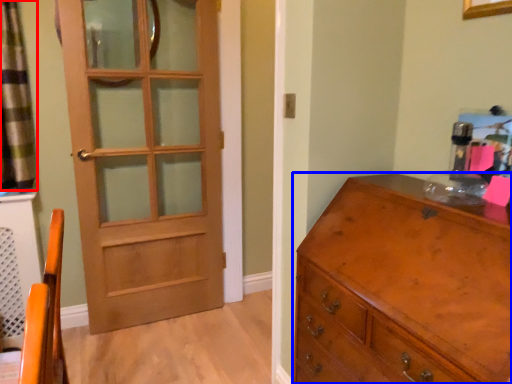
Question: Which of the following is the farthest to the observer, curtain (highlighted by a red box) or chest of drawers (highlighted by a blue box)?

Choices:
 (A) curtain
 (B) chest of drawers

Answer: (A)